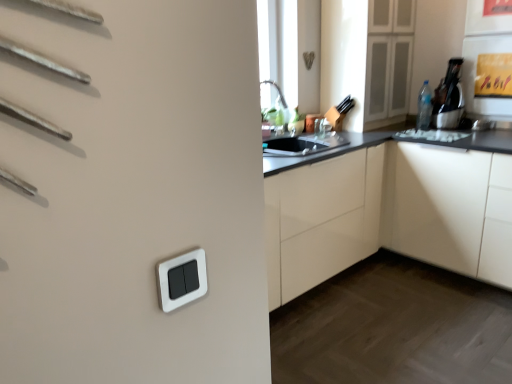
Question: Can you confirm if matte black kettle at upper right is positioned to the left of white glossy cabinet at upper right, the second cabinetry when ordered from right to left?

Choices:
 (A) no
 (B) yes

Answer: (A)

Question: Considering the relative sizes of matte black kettle at upper right and white glossy cabinet at upper right, the second cabinetry when ordered from right to left, in the image provided, is matte black kettle at upper right thinner than white glossy cabinet at upper right, the second cabinetry when ordered from right to left,?

Choices:
 (A) no
 (B) yes

Answer: (B)

Question: Does matte black kettle at upper right turn towards white glossy cabinet at upper right, the 2th cabinetry positioned from the left?

Choices:
 (A) yes
 (B) no

Answer: (B)

Question: Is matte black kettle at upper right positioned with its back to white glossy cabinet at upper right, the 2th cabinetry positioned from the left?

Choices:
 (A) no
 (B) yes

Answer: (A)

Question: Does matte black kettle at upper right have a smaller size compared to white glossy cabinet at upper right, the 2th cabinetry positioned from the left?

Choices:
 (A) no
 (B) yes

Answer: (B)

Question: From a real-world perspective, is matte black kettle at upper right under white glossy cabinet at upper right, the second cabinetry when ordered from right to left?

Choices:
 (A) yes
 (B) no

Answer: (A)

Question: Is white glossy cabinet at center, the first cabinetry in the left-to-right sequence, located outside clear plastic bottle at upper right?

Choices:
 (A) yes
 (B) no

Answer: (A)

Question: From the image's perspective, is white glossy cabinet at center, the first cabinetry in the left-to-right sequence, on clear plastic bottle at upper right?

Choices:
 (A) yes
 (B) no

Answer: (B)

Question: Is white glossy cabinet at center, the first cabinetry in the left-to-right sequence, behind clear plastic bottle at upper right?

Choices:
 (A) yes
 (B) no

Answer: (B)

Question: Is the position of white glossy cabinet at center, the third cabinetry when ordered from right to left, less distant than that of clear plastic bottle at upper right?

Choices:
 (A) yes
 (B) no

Answer: (A)

Question: From the image's perspective, is white glossy cabinet at center, the first cabinetry in the left-to-right sequence, located beneath clear plastic bottle at upper right?

Choices:
 (A) yes
 (B) no

Answer: (A)

Question: Considering the relative sizes of white glossy cabinet at center, the third cabinetry when ordered from right to left, and clear plastic bottle at upper right in the image provided, is white glossy cabinet at center, the third cabinetry when ordered from right to left, taller than clear plastic bottle at upper right?

Choices:
 (A) no
 (B) yes

Answer: (B)

Question: Is white glossy cabinet at center, the third cabinetry when ordered from left to right, not near silver metallic faucet at upper center?

Choices:
 (A) yes
 (B) no

Answer: (B)